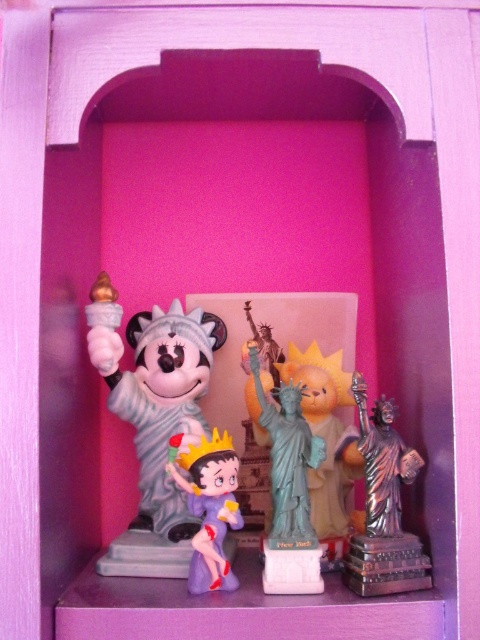
You are an interior designer arranging miniature figurines in a pink arched niche. You have a matte plastic minnie mouse statue at center and a green matte statue of liberty at center. Based on their positions, which figurine is placed higher up?

The matte plastic minnie mouse statue at center is located above the green matte statue of liberty at center, so it is placed higher up.

You are a collector trying to place a new figurine that is 5 inches wide between the matte gray statue at center and the matte plastic betty boop at center. Based on the space between them, will the new figurine fit?

The distance between the matte gray statue at center and the matte plastic betty boop at center is 4.63 inches. Since the new figurine is 5 inches wide, it will not fit in the available space.

You are a photographer setting up a shot of the miniature figurines displayed in the pink arched niche. You want to ensure the matte plastic minnie mouse statue at center is in focus. Given that your camera has a depth of field that can sharply capture objects within 80 centimeters, will the statue be in focus?

A: The matte plastic minnie mouse statue at center is 81.21 centimeters away from the camera. Since the depth of field can only sharply capture objects within 80 centimeters, the statue is slightly out of range and will not be in focus.